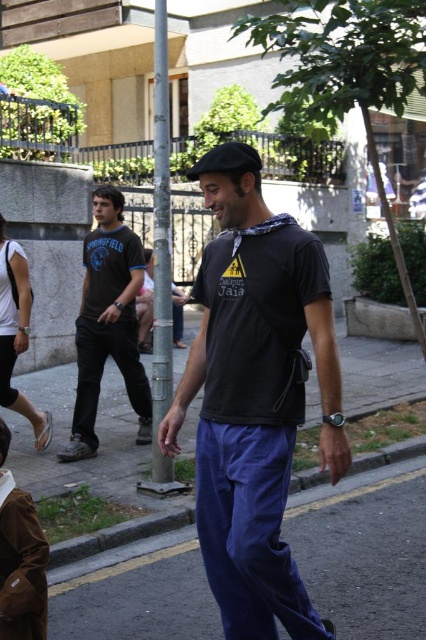
You are standing on the sidewalk and see the man in the foreground. Where is the blue fabric pants at lower center positioned relative to the man?

The blue fabric pants at lower center is located at point (353, 541), which is near the lower part of the man, indicating they are part of his clothing and positioned at his lower body area.

You are a photographer trying to capture the matte black t shirt at center in the image. The camera you are using has a focus point at coordinate point (x=108, y=323). Is the focus point correctly placed to capture the matte black t shirt at center?

Yes, the focus point at coordinate point (x=108, y=323) is correctly placed to capture the matte black t shirt at center because the point indicates the location of the matte black t shirt at center.